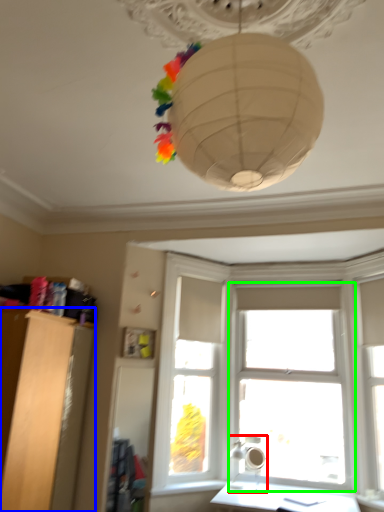
Question: Based on their relative distances, which object is farther from lamp (highlighted by a red box)? Choose from furniture (highlighted by a blue box) and window (highlighted by a green box).

Choices:
 (A) furniture
 (B) window

Answer: (A)